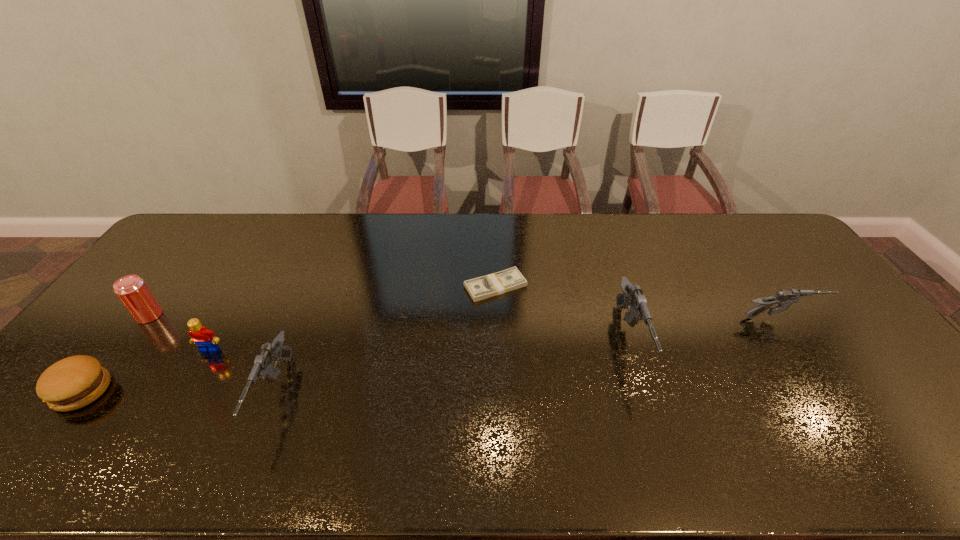
The width and height of the screenshot is (960, 540). Identify the location of vacant spot for a new gun to ensure equal spacing. (462, 367).